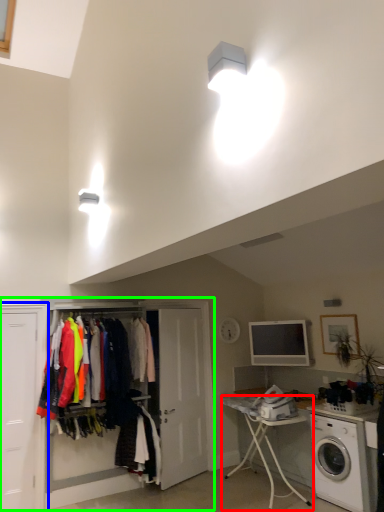
Question: Estimate the real-world distances between objects in this image. Which object is closer to table (highlighted by a red box), door (highlighted by a blue box) or armoire (highlighted by a green box)?

Choices:
 (A) door
 (B) armoire

Answer: (B)